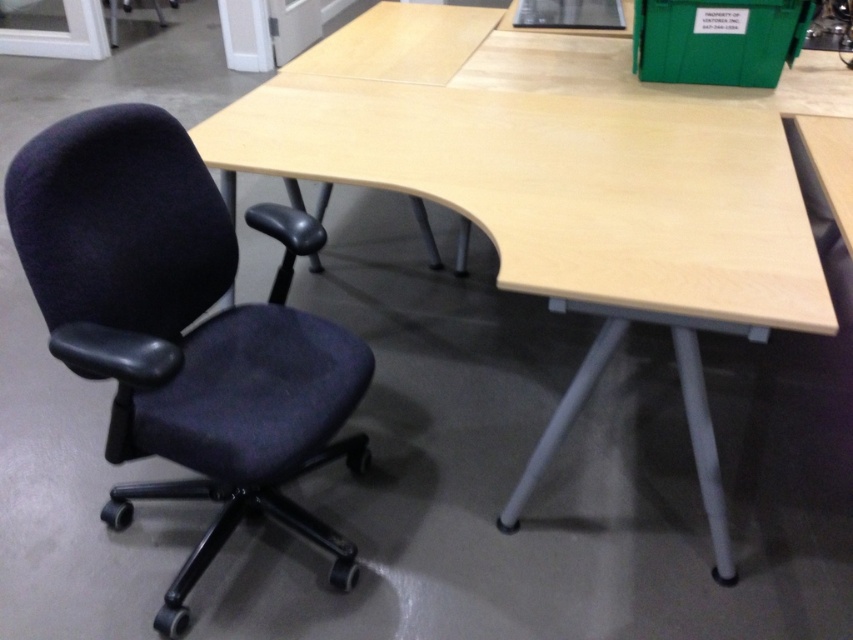
You are standing in the office and want to place a new potted plant on the desk. The potted plant has a diameter of 20 cm. Can you determine if there is enough space on the desk at the point indicated by the coordinates point (554, 195) to place the potted plant?

The light wood wooden table at center has a rectangular shape with a slight curve at the front edge. The desk surface is clean and uncluttered with no visible items other than a green plastic storage bin placed at one corner. The point (554, 195) is located at the center of the desk. Since the desk is uncluttered except for the storage bin at the corner, there should be sufficient space at the center to place the 20 cm diameter potted plant.